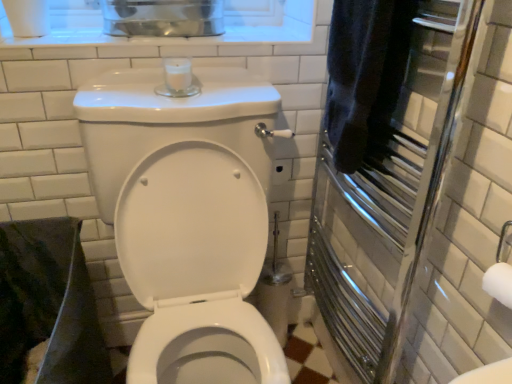
Question: Is there a large distance between polished chrome towel warmer at right and dark blue towel at right?

Choices:
 (A) no
 (B) yes

Answer: (A)

Question: From a real-world perspective, is polished chrome towel warmer at right located beneath dark blue towel at right?

Choices:
 (A) yes
 (B) no

Answer: (A)

Question: Is polished chrome towel warmer at right located outside dark blue towel at right?

Choices:
 (A) no
 (B) yes

Answer: (B)

Question: From the image's perspective, is polished chrome towel warmer at right over dark blue towel at right?

Choices:
 (A) yes
 (B) no

Answer: (B)

Question: Does polished chrome towel warmer at right have a lesser height compared to dark blue towel at right?

Choices:
 (A) no
 (B) yes

Answer: (A)

Question: Is white glossy toilet at center wider or thinner than polished chrome towel warmer at right?

Choices:
 (A) wide
 (B) thin

Answer: (A)

Question: Is white glossy toilet at center taller or shorter than polished chrome towel warmer at right?

Choices:
 (A) tall
 (B) short

Answer: (A)

Question: Considering the positions of white glossy toilet at center and polished chrome towel warmer at right in the image, is white glossy toilet at center bigger or smaller than polished chrome towel warmer at right?

Choices:
 (A) big
 (B) small

Answer: (A)

Question: Is white glossy toilet at center inside or outside of polished chrome towel warmer at right?

Choices:
 (A) inside
 (B) outside

Answer: (B)

Question: Is polished chrome towel warmer at right inside or outside of white glossy toilet at center?

Choices:
 (A) outside
 (B) inside

Answer: (A)

Question: Is polished chrome towel warmer at right wider or thinner than white glossy toilet at center?

Choices:
 (A) wide
 (B) thin

Answer: (B)

Question: Is polished chrome towel warmer at right taller or shorter than white glossy toilet at center?

Choices:
 (A) short
 (B) tall

Answer: (A)

Question: Does point (375, 216) appear closer or farther from the camera than point (134, 72)?

Choices:
 (A) farther
 (B) closer

Answer: (A)

Question: Is white glossy toilet at center in front of or behind dark blue towel at right in the image?

Choices:
 (A) behind
 (B) front

Answer: (B)

Question: Considering the positions of white glossy toilet at center and dark blue towel at right in the image, is white glossy toilet at center bigger or smaller than dark blue towel at right?

Choices:
 (A) big
 (B) small

Answer: (A)